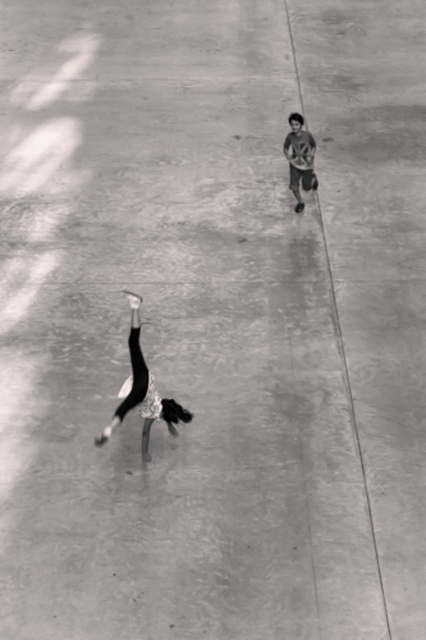
Question: Does black fabric child at center have a larger size compared to matte gray shirt at upper right?

Choices:
 (A) yes
 (B) no

Answer: (A)

Question: Which of the following is the closest to the observer?

Choices:
 (A) black fabric child at center
 (B) matte gray shirt at upper right

Answer: (A)

Question: Which object appears farthest from the camera in this image?

Choices:
 (A) matte gray shirt at upper right
 (B) black fabric child at center

Answer: (A)

Question: Which object appears farthest from the camera in this image?

Choices:
 (A) black fabric child at center
 (B) matte gray shirt at upper right

Answer: (B)

Question: Does black fabric child at center have a smaller size compared to matte gray shirt at upper right?

Choices:
 (A) yes
 (B) no

Answer: (B)

Question: Is black fabric child at center smaller than matte gray shirt at upper right?

Choices:
 (A) no
 (B) yes

Answer: (A)